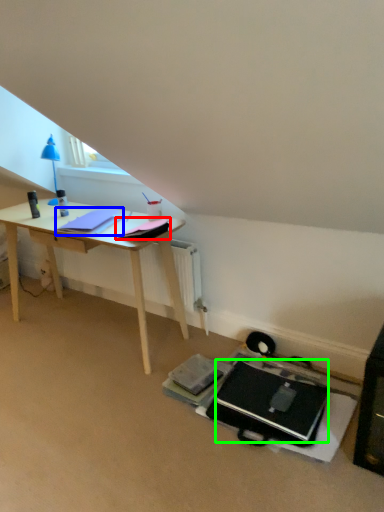
Question: Which object is the closest to the notepad (highlighted by a red box)? Choose among these: notepad (highlighted by a blue box) or laptop (highlighted by a green box).

Choices:
 (A) notepad
 (B) laptop

Answer: (A)